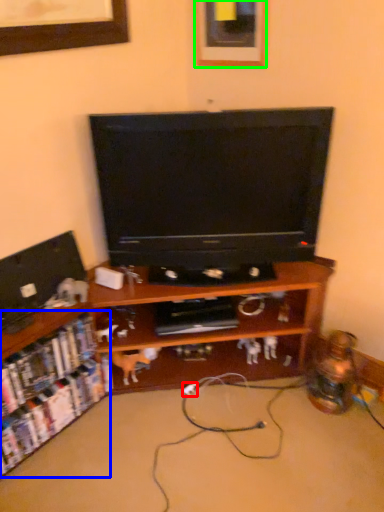
Question: Estimate the real-world distances between objects in this image. Which object is farther from extension cord (highlighted by a red box), shelf (highlighted by a blue box) or picture frame (highlighted by a green box)?

Choices:
 (A) shelf
 (B) picture frame

Answer: (B)